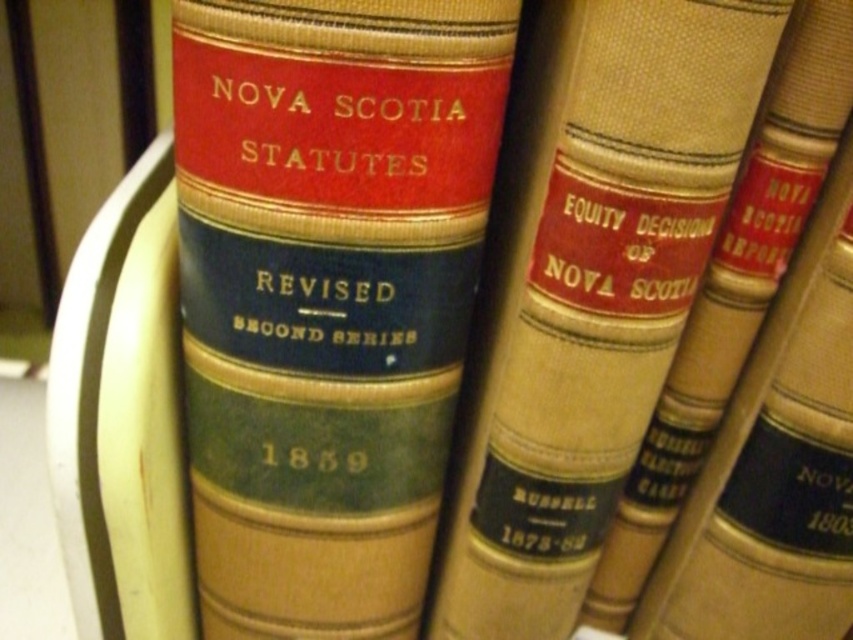
Between matte leather book at center and beige leather book at center, which one is positioned higher?

Positioned higher is beige leather book at center.

Is matte leather book at center wider than beige leather book at center?

Yes.

Which is in front, point (340, 108) or point (495, 362)?

Point (340, 108)

Find the location of a particular element. matte leather book at center is located at coordinates (328, 292).